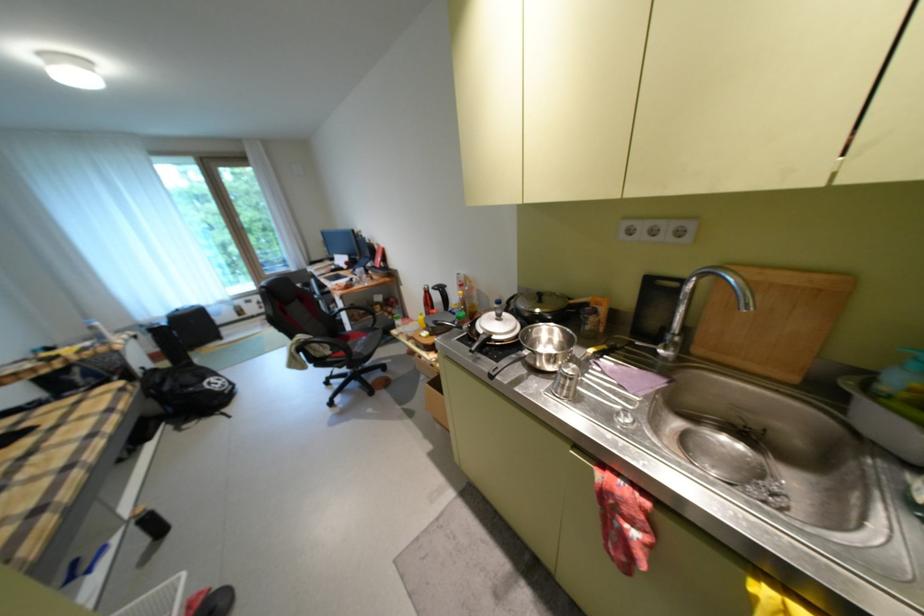
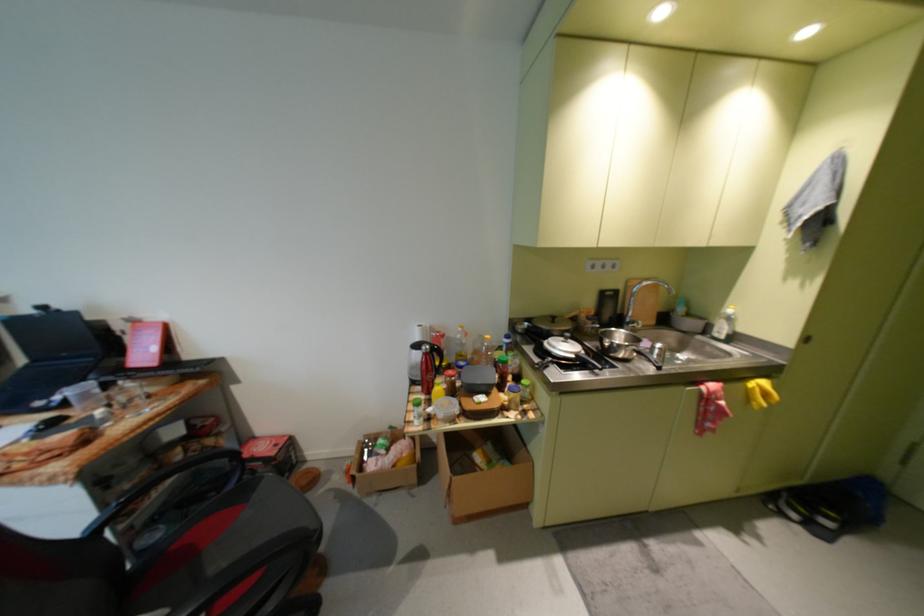
Where in the second image is the point corresponding to pixel 419 318 from the first image?

(264, 439)